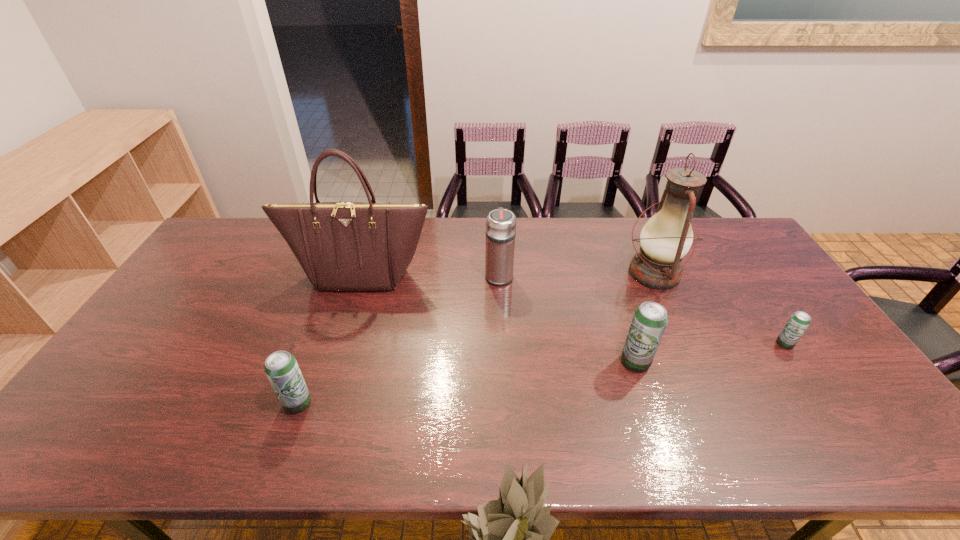
The width and height of the screenshot is (960, 540). Identify the location of vacant space that satisfies the following two spatial constraints: 1. on the front-facing side of the second beer can from left to right; 2. on the right side of the handbag. coord(333,362).